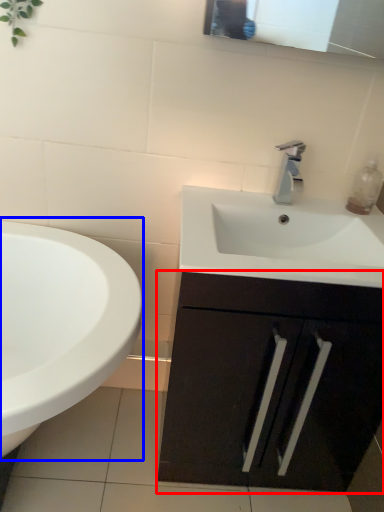
Question: Which point is closer to the camera, bathroom cabinet (highlighted by a red box) or sink (highlighted by a blue box)?

Choices:
 (A) bathroom cabinet
 (B) sink

Answer: (B)